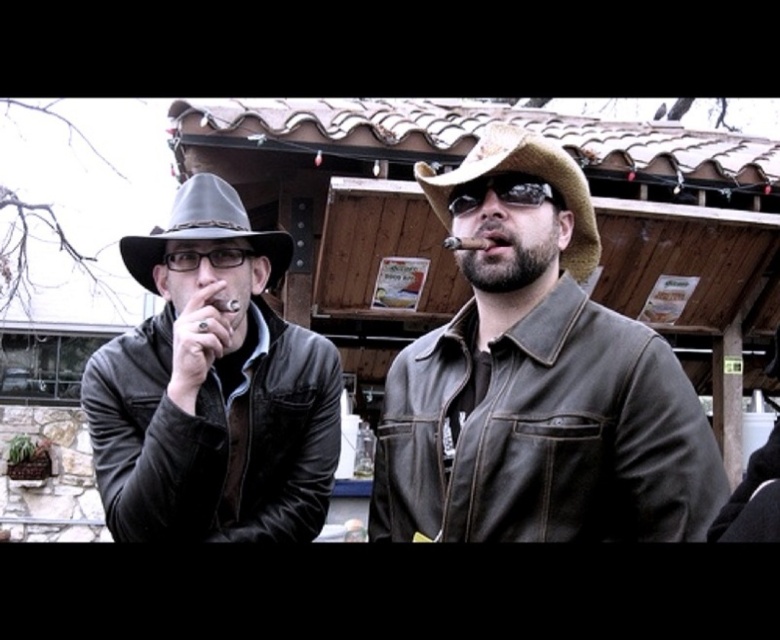
Question: Does matte black fedora at left have a greater width compared to smooth brown cigar at center?

Choices:
 (A) yes
 (B) no

Answer: (A)

Question: Does brown leather jacket at center appear over matte black fedora at left?

Choices:
 (A) yes
 (B) no

Answer: (B)

Question: Does matte black leather jacket at left appear over matte black fedora at left?

Choices:
 (A) no
 (B) yes

Answer: (A)

Question: Based on their relative distances, which object is nearer to the brown leather jacket at center?

Choices:
 (A) brown leather hat at center
 (B) smooth brown cigar at center

Answer: (A)

Question: Which point is closer to the camera?

Choices:
 (A) matte black fedora at left
 (B) brown leather jacket at center
 (C) smooth brown cigar at center
 (D) matte black leather jacket at left

Answer: (B)

Question: Which object appears closest to the camera in this image?

Choices:
 (A) brown leather hat at center
 (B) matte black fedora at left
 (C) brown leather jacket at center

Answer: (C)